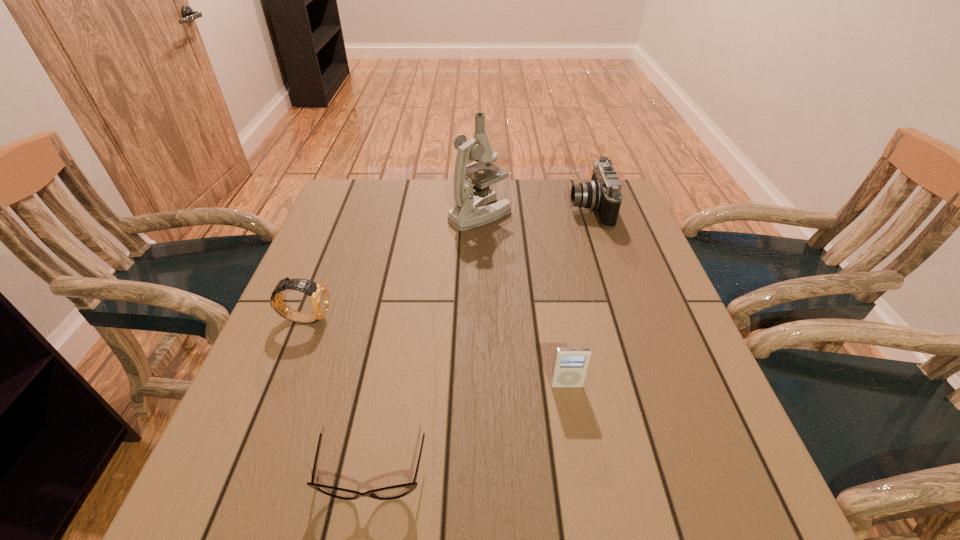
Locate an element on the screen. This screenshot has width=960, height=540. vacant space situated on the front-facing side of the camera is located at coordinates (522, 210).

The image size is (960, 540). In order to click on free space located 0.230m on the front-facing side of the camera in this screenshot , I will do `click(492, 210)`.

Image resolution: width=960 pixels, height=540 pixels. What are the coordinates of `free location located 0.380m on the front-facing side of the camera` in the screenshot? It's located at (442, 210).

The image size is (960, 540). What are the coordinates of `vacant space located 0.330m on the face of the third farthest object` in the screenshot? It's located at pyautogui.click(x=479, y=318).

Find the location of a particular element. The image size is (960, 540). free spot located on the front-facing side of the second nearest object is located at coordinates (575, 437).

Where is `microscope that is positioned at the far edge`? microscope that is positioned at the far edge is located at coordinates (472, 208).

Locate an element on the screen. The image size is (960, 540). camera that is at the far edge is located at coordinates (602, 195).

This screenshot has height=540, width=960. I want to click on object at the near edge, so click(x=397, y=491).

Identify the location of object that is at the left edge. (319, 297).

I want to click on object situated at the right edge, so click(602, 195).